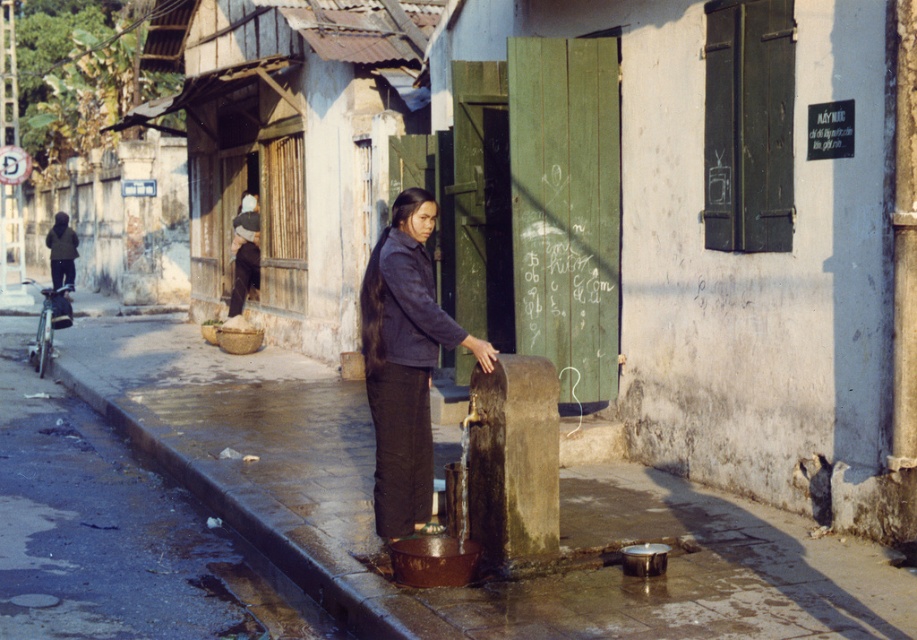
Question: Does rusty metal bucket at center appear on the left side of dark blue fabric jacket at center?

Choices:
 (A) no
 (B) yes

Answer: (B)

Question: Can you confirm if rusty metal bucket at center is positioned to the left of dark blue fabric jacket at center?

Choices:
 (A) yes
 (B) no

Answer: (A)

Question: Can you confirm if rusty metal bucket at center is positioned above dark blue fabric jacket at center?

Choices:
 (A) yes
 (B) no

Answer: (B)

Question: Which point appears farthest from the camera in this image?

Choices:
 (A) (636, 499)
 (B) (395, 468)

Answer: (A)